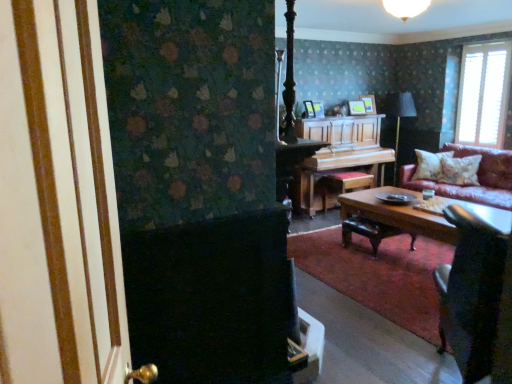
Question: From a real-world perspective, is white textured pillow at right, the first pillow in the back-to-front sequence, positioned under wooden polished coffee table at center based on gravity?

Choices:
 (A) no
 (B) yes

Answer: (A)

Question: Is white textured pillow at right, marked as the second pillow in a front-to-back arrangement, positioned beyond the bounds of wooden polished coffee table at center?

Choices:
 (A) yes
 (B) no

Answer: (A)

Question: Is white textured pillow at right, marked as the second pillow in a front-to-back arrangement, in contact with wooden polished coffee table at center?

Choices:
 (A) no
 (B) yes

Answer: (A)

Question: Is white textured pillow at right, marked as the second pillow in a front-to-back arrangement, bigger than wooden polished coffee table at center?

Choices:
 (A) yes
 (B) no

Answer: (B)

Question: Is white textured pillow at right, marked as the second pillow in a front-to-back arrangement, aimed at wooden polished coffee table at center?

Choices:
 (A) yes
 (B) no

Answer: (A)

Question: Considering the positions of velvet dark brown armchair at lower right and white textured blinds at upper right in the image, is velvet dark brown armchair at lower right bigger or smaller than white textured blinds at upper right?

Choices:
 (A) big
 (B) small

Answer: (A)

Question: Visually, is velvet dark brown armchair at lower right positioned to the left or to the right of white textured blinds at upper right?

Choices:
 (A) left
 (B) right

Answer: (A)

Question: Is velvet dark brown armchair at lower right wider or thinner than white textured blinds at upper right?

Choices:
 (A) thin
 (B) wide

Answer: (B)

Question: From their relative heights in the image, would you say velvet dark brown armchair at lower right is taller or shorter than white textured blinds at upper right?

Choices:
 (A) tall
 (B) short

Answer: (B)

Question: From the image's perspective, is white textured pillow at right, marked as the second pillow in a front-to-back arrangement, positioned above or below velvet dark brown armchair at lower right?

Choices:
 (A) below
 (B) above

Answer: (B)

Question: From a real-world perspective, relative to velvet dark brown armchair at lower right, is white textured pillow at right, marked as the second pillow in a front-to-back arrangement, vertically above or below?

Choices:
 (A) below
 (B) above

Answer: (B)

Question: In terms of size, does white textured pillow at right, marked as the second pillow in a front-to-back arrangement, appear bigger or smaller than velvet dark brown armchair at lower right?

Choices:
 (A) small
 (B) big

Answer: (A)

Question: Visually, is white textured pillow at right, the first pillow in the back-to-front sequence, positioned to the left or to the right of velvet dark brown armchair at lower right?

Choices:
 (A) right
 (B) left

Answer: (A)

Question: Considering the relative positions of fluffy white pillow at right, which appears as the 2th pillow when viewed from the back, and wooden polished coffee table at center in the image provided, is fluffy white pillow at right, which appears as the 2th pillow when viewed from the back, to the left or to the right of wooden polished coffee table at center?

Choices:
 (A) right
 (B) left

Answer: (A)

Question: Relative to wooden polished coffee table at center, is fluffy white pillow at right, which appears as the 2th pillow when viewed from the back, in front or behind?

Choices:
 (A) front
 (B) behind

Answer: (B)